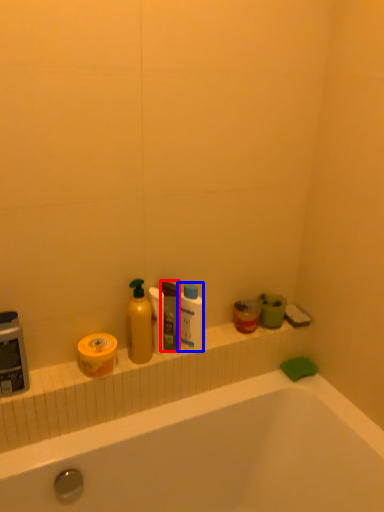
Question: Which of the following is the farthest to the observer, mouthwash (highlighted by a red box) or cleaning product (highlighted by a blue box)?

Choices:
 (A) mouthwash
 (B) cleaning product

Answer: (B)